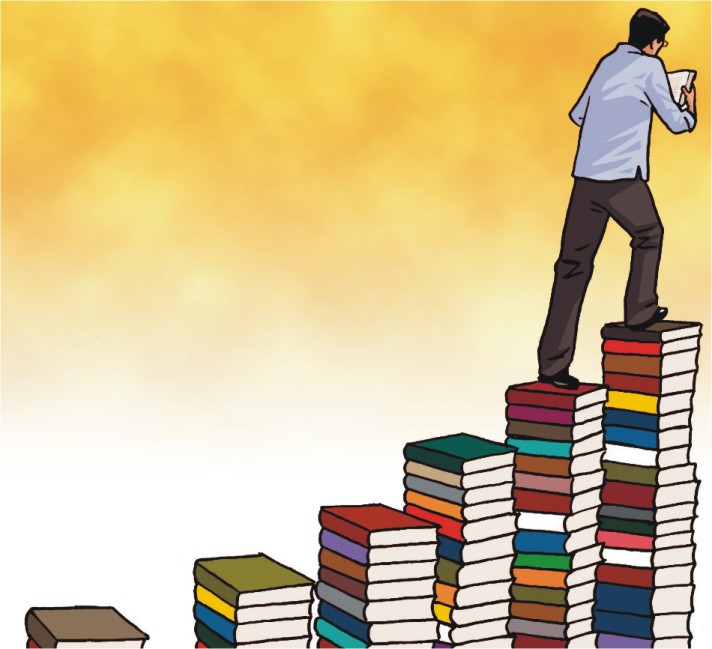
This screenshot has height=649, width=712. Identify the location of top book in stack. (90, 630), (241, 578), (361, 520), (460, 447), (540, 393), (651, 330).